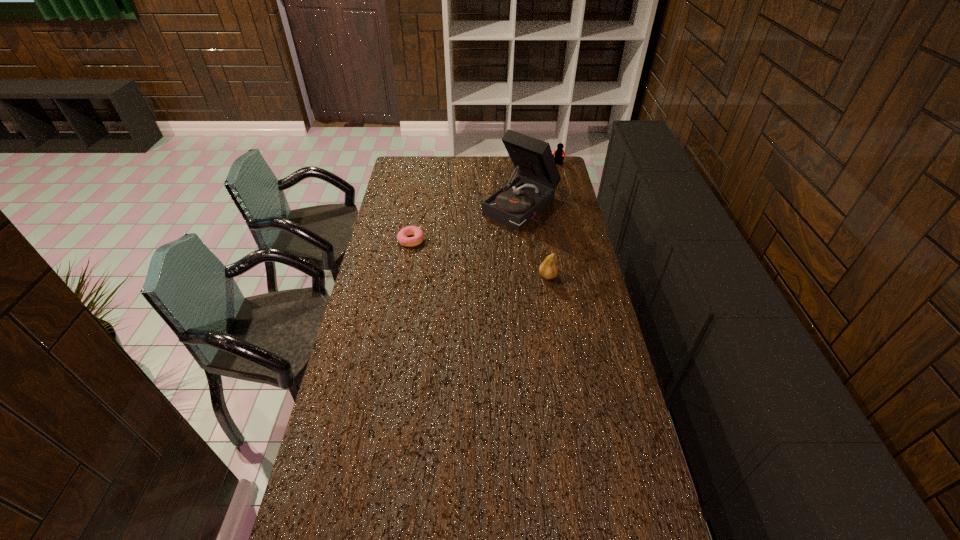
Identify the location of the shortest object. This screenshot has height=540, width=960. (402, 238).

What are the coordinates of `doughnut` in the screenshot? It's located at (402, 238).

You are a GUI agent. You are given a task and a screenshot of the screen. Output one action in this format:
    pyautogui.click(x=<x>, y=<y>)
    Task: Click on the nearest object
    
    Given the screenshot: What is the action you would take?
    (x=548, y=269)

You are a GUI agent. You are given a task and a screenshot of the screen. Output one action in this format:
    pyautogui.click(x=<x>, y=<y>)
    Task: Click on the phonograph_record
    Image resolution: width=960 pixels, height=540 pixels.
    Given the screenshot: What is the action you would take?
    pyautogui.click(x=518, y=202)

Locate an element on the screen. the tallest object is located at coordinates (518, 202).

Identify the location of the farthest object. The width and height of the screenshot is (960, 540). (559, 153).

This screenshot has height=540, width=960. Identify the location of free spot located 0.200m on the front of the shortest object. (404, 281).

Where is `free spot located 0.180m on the front of the pear`? free spot located 0.180m on the front of the pear is located at coordinates (554, 317).

The height and width of the screenshot is (540, 960). Find the location of `free location located 0.130m on the front-facing side of the phonograph_record`. free location located 0.130m on the front-facing side of the phonograph_record is located at coordinates (481, 240).

This screenshot has height=540, width=960. What are the coordinates of `free space located 0.140m on the front-facing side of the phonograph_record` in the screenshot? It's located at (479, 241).